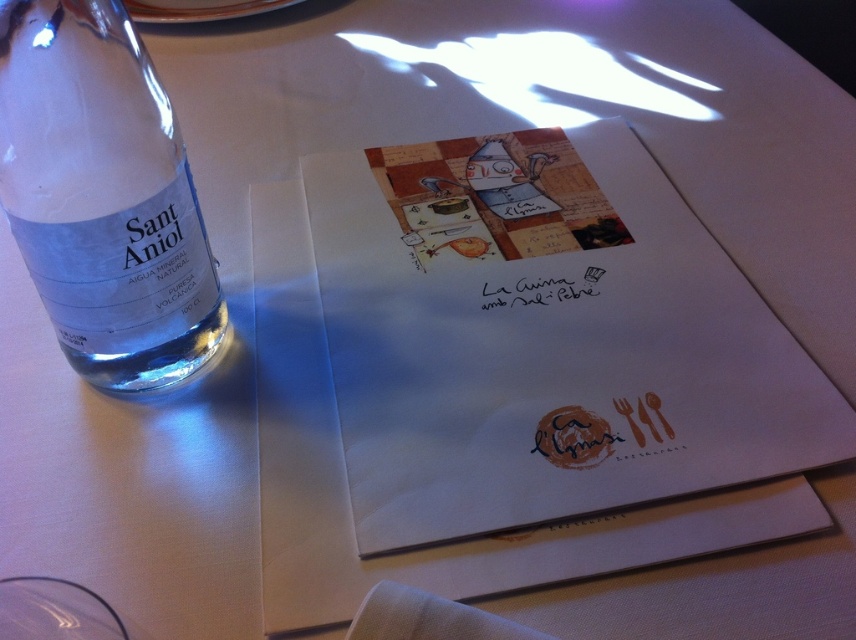
You are a server at a restaurant and need to place a 7.5 inch long decorative plate between the white paper menu at center and the clear glass bottle at left. Can you fit it there?

The distance between the white paper menu at center and the clear glass bottle at left is 6.75 inches, which is shorter than the 7.5 inch long decorative plate. Therefore, the plate cannot fit between them.

You are a waiter who needs to place a new menu on the table. The current menu is at the white paper menu at center. Where should you place the new menu so that it is exactly 0.1 units to the right and 0.05 units above the current menu?

Result: The new menu should be placed at the coordinates calculated by adding 0.1 to the x and 0.05 to the y of the white paper menu at center. Since the current menu is at point (544, 339), the new coordinates would be 0.630 in x and 0.687 in y.

You need to place a 10 cm wide decorative item on the table. The white paper menu at center and the clear glass bottle at left are already there. Which object can you place the item next to without overlapping?

The white paper menu at center has a larger width than the clear glass bottle at left, so you can place the 10 cm wide decorative item next to the white paper menu at center without overlapping.